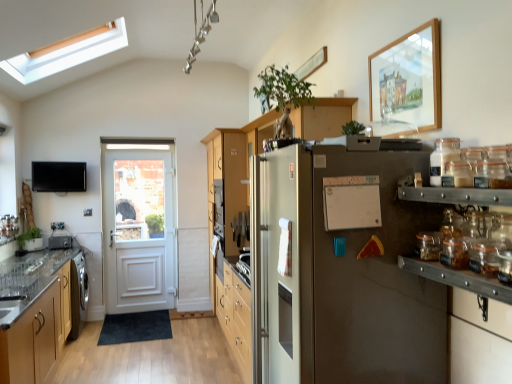
Question: Is wooden cabinet at left turned away from metallic silver toaster at left?

Choices:
 (A) yes
 (B) no

Answer: (B)

Question: Does wooden cabinet at left lie in front of metallic silver toaster at left?

Choices:
 (A) yes
 (B) no

Answer: (A)

Question: Is wooden cabinet at left thinner than metallic silver toaster at left?

Choices:
 (A) no
 (B) yes

Answer: (A)

Question: Is wooden cabinet at left outside of metallic silver toaster at left?

Choices:
 (A) no
 (B) yes

Answer: (B)

Question: Does wooden cabinet at left lie behind metallic silver toaster at left?

Choices:
 (A) yes
 (B) no

Answer: (B)

Question: Is wooden cabinet at left shorter than metallic silver toaster at left?

Choices:
 (A) no
 (B) yes

Answer: (A)

Question: Can you confirm if white matte bulletin board at center is smaller than clear glass jar at right, the second glass jar in the top-to-bottom sequence?

Choices:
 (A) no
 (B) yes

Answer: (A)

Question: Is white matte bulletin board at center taller than clear glass jar at right, the second glass jar in the top-to-bottom sequence?

Choices:
 (A) yes
 (B) no

Answer: (A)

Question: Is white matte bulletin board at center not close to clear glass jar at right, the second glass jar in the top-to-bottom sequence?

Choices:
 (A) yes
 (B) no

Answer: (B)

Question: Considering the relative sizes of white matte bulletin board at center and clear glass jar at right, which is counted as the 1th glass jar, starting from the bottom, in the image provided, is white matte bulletin board at center bigger than clear glass jar at right, which is counted as the 1th glass jar, starting from the bottom,?

Choices:
 (A) no
 (B) yes

Answer: (B)

Question: Considering the relative sizes of white matte bulletin board at center and clear glass jar at right, which is counted as the 1th glass jar, starting from the bottom, in the image provided, is white matte bulletin board at center shorter than clear glass jar at right, which is counted as the 1th glass jar, starting from the bottom,?

Choices:
 (A) no
 (B) yes

Answer: (A)

Question: Is white matte bulletin board at center surrounding clear glass jar at right, the second glass jar in the top-to-bottom sequence?

Choices:
 (A) yes
 (B) no

Answer: (B)

Question: From a real-world perspective, is clear glass door at left on white matte bulletin board at center?

Choices:
 (A) no
 (B) yes

Answer: (A)